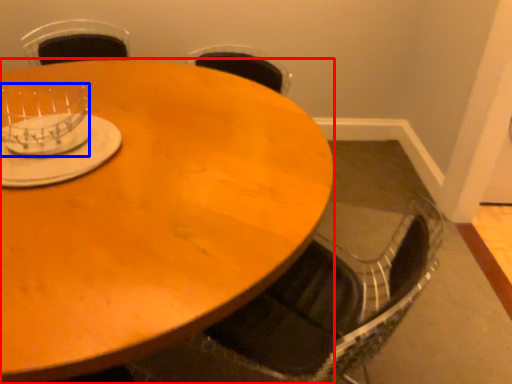
Question: Which of the following is the closest to the observer, coffee table (highlighted by a red box) or tableware (highlighted by a blue box)?

Choices:
 (A) coffee table
 (B) tableware

Answer: (A)